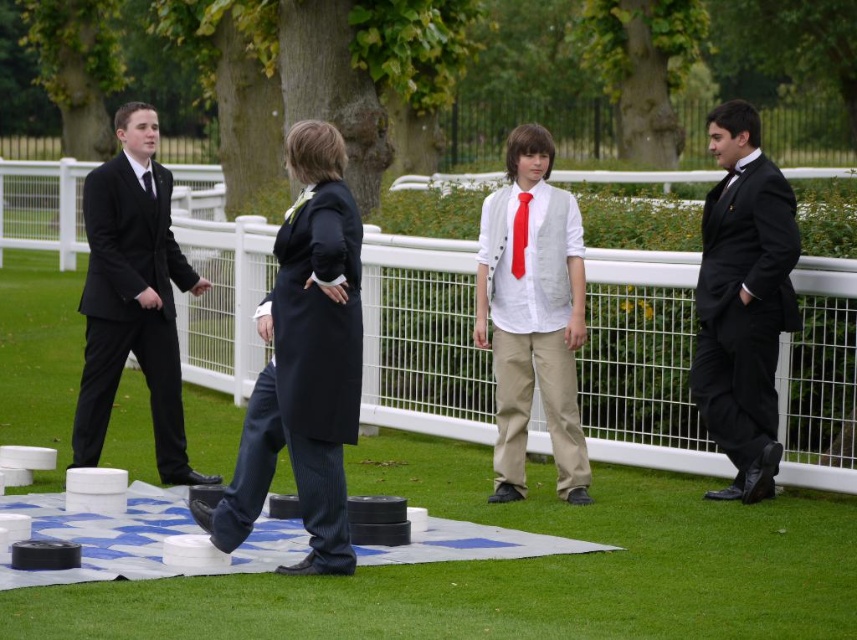
Question: Which of the following is the closest to the observer?

Choices:
 (A) (147, 189)
 (B) (307, 378)

Answer: (B)

Question: Does matte black coat at center lie behind red satin tie at center?

Choices:
 (A) no
 (B) yes

Answer: (A)

Question: Which object is the closest to the black satin suit at left?

Choices:
 (A) matte black tie at left
 (B) red satin tie at center
 (C) white wire fence at center
 (D) matte black coat at center

Answer: (A)

Question: Is green grass at center to the right of dark blue wool coat at center from the viewer's perspective?

Choices:
 (A) yes
 (B) no

Answer: (B)

Question: In this image, where is green grass at center located relative to matte black tie at left?

Choices:
 (A) right
 (B) left

Answer: (A)

Question: Which point appears farthest from the camera in this image?

Choices:
 (A) (117, 310)
 (B) (430, 467)
 (C) (67, 227)
 (D) (255, 387)

Answer: (C)